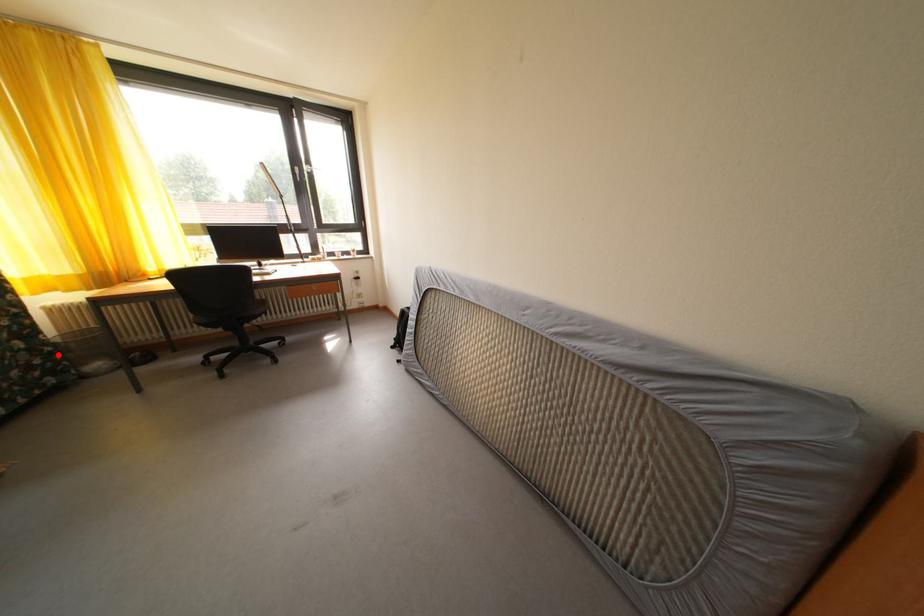
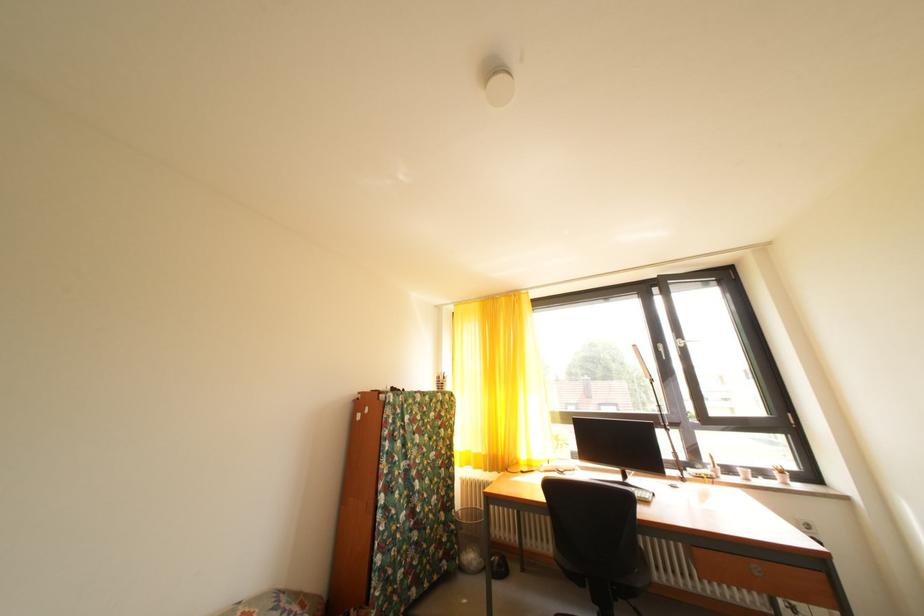
In the second image, find the point that corresponds to the highlighted location in the first image.

(462, 533)